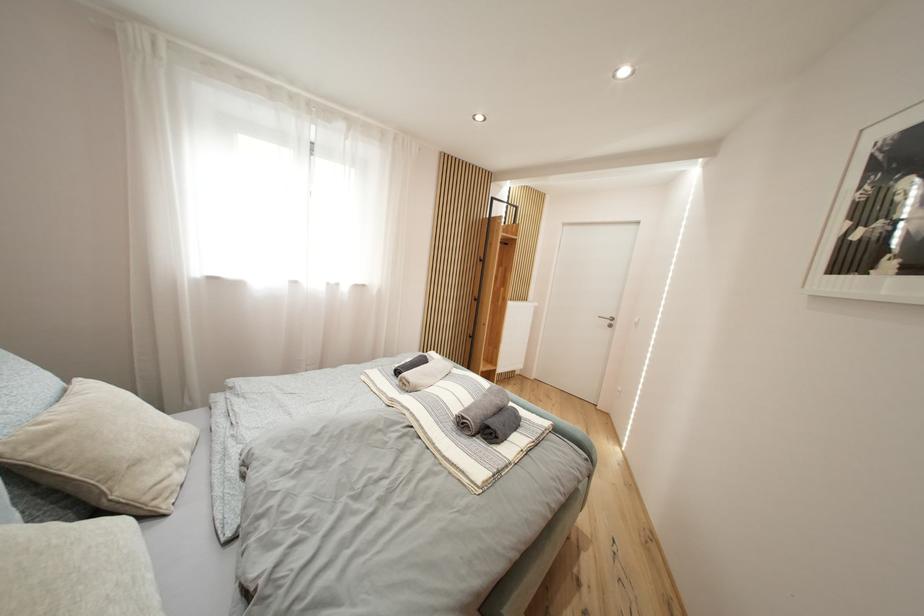
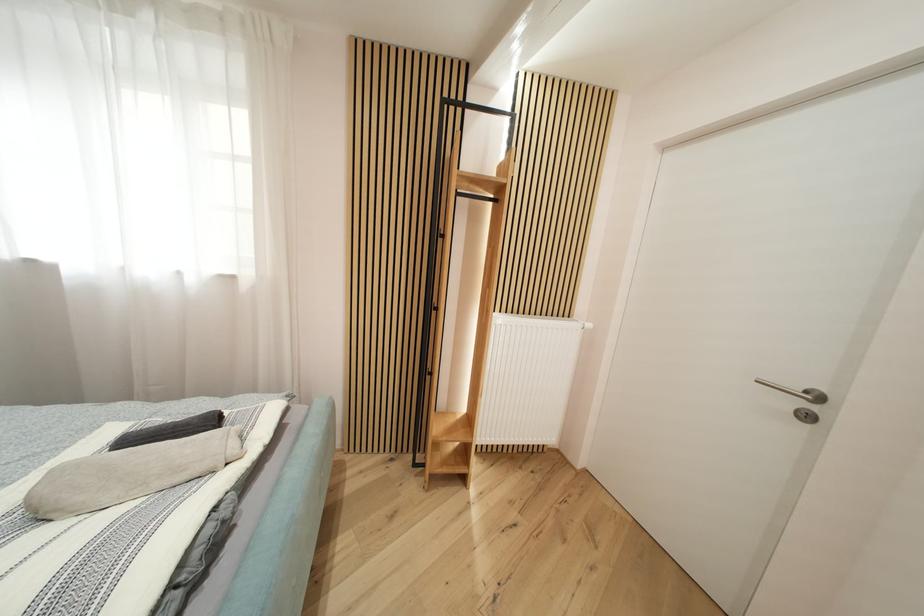
The images are taken continuously from a first-person perspective. In which direction are you moving?

The cameraman walked toward right, forward.